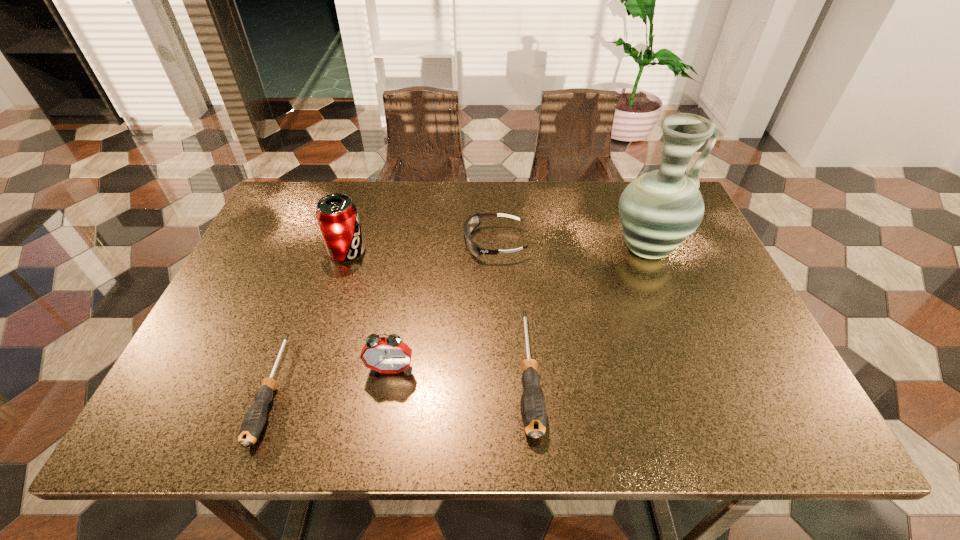
Where is `the shortest object`? The image size is (960, 540). the shortest object is located at coordinates [x=252, y=425].

Find the location of a particular element. The image size is (960, 540). the shorter screwdriver is located at coordinates (252, 425).

This screenshot has width=960, height=540. What are the coordinates of `the right screwdriver` in the screenshot? It's located at coord(533,410).

Locate an element on the screen. the taller screwdriver is located at coordinates (533, 410).

Identify the location of the rightmost object. (658, 210).

You are a GUI agent. You are given a task and a screenshot of the screen. Output one action in this format:
    pyautogui.click(x=<x>, y=<y>)
    Task: Click on the tallest object
    The image size is (960, 540).
    Given the screenshot: What is the action you would take?
    pyautogui.click(x=658, y=210)

Find the location of `the third shortest object`. the third shortest object is located at coordinates (472, 222).

The width and height of the screenshot is (960, 540). I want to click on the fifth shortest object, so [337, 216].

Where is `the fourth shortest object`? the fourth shortest object is located at coordinates (390, 354).

Image resolution: width=960 pixels, height=540 pixels. Identify the location of the fourth object from right to left. (390, 354).